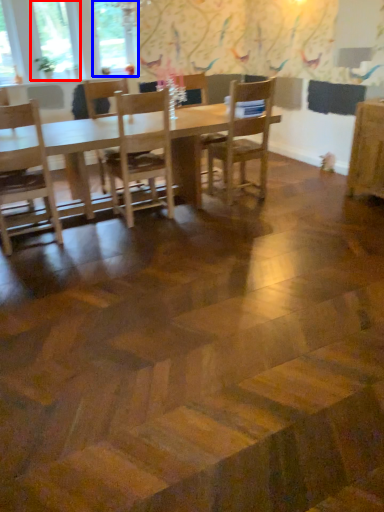
Question: Among these objects, which one is farthest to the camera, window (highlighted by a red box) or window (highlighted by a blue box)?

Choices:
 (A) window
 (B) window

Answer: (B)